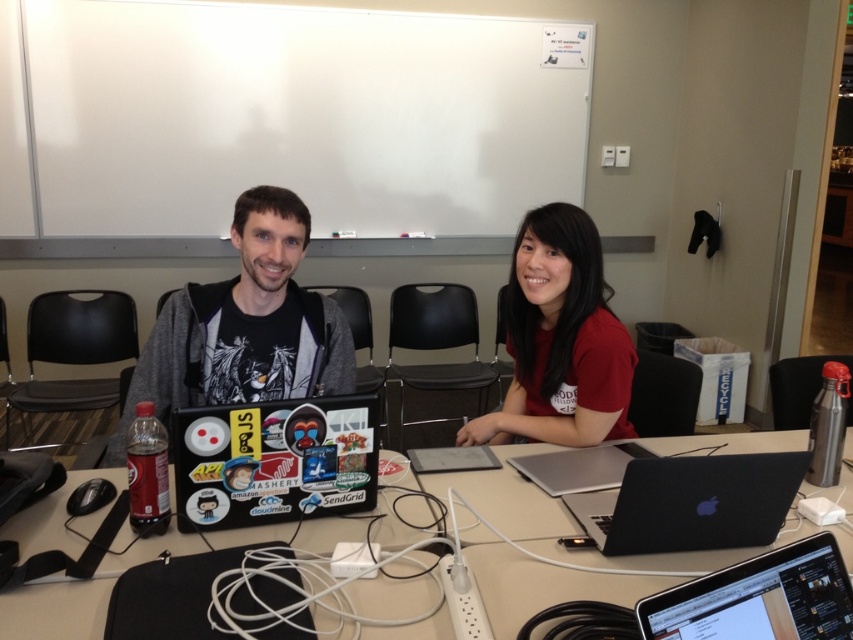
Question: Which point is farther to the camera?

Choices:
 (A) (689, 608)
 (B) (288, 374)

Answer: (B)

Question: Can you confirm if black plastic table at center is positioned to the left of matte black laptop at center?

Choices:
 (A) no
 (B) yes

Answer: (A)

Question: Is matte red shirt at center positioned in front of black plastic laptop at lower right?

Choices:
 (A) no
 (B) yes

Answer: (A)

Question: Among these points, which one is farthest from the camera?

Choices:
 (A) (115, 465)
 (B) (28, 541)
 (C) (625, 528)

Answer: (A)

Question: Which of the following is the closest to the observer?

Choices:
 (A) (639, 532)
 (B) (535, 252)
 (C) (828, 593)
 (D) (341, 376)

Answer: (C)

Question: Can you confirm if matte red shirt at center is wider than black plastic laptop at lower right?

Choices:
 (A) yes
 (B) no

Answer: (A)